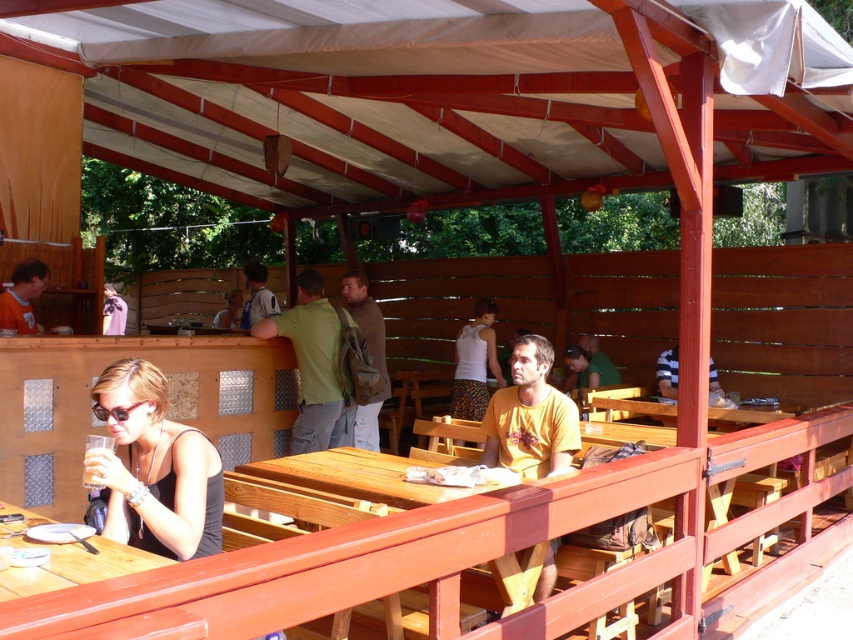
Is matte black tank top at lower left closer to the viewer compared to striped cotton shirt at center?

That is True.

Is point (122, 522) less distant than point (712, 364)?

Yes, it is in front of point (712, 364).

Identify the location of matte black tank top at lower left. The width and height of the screenshot is (853, 640). (155, 467).

Who is taller, yellow t-shirt at center or orange t-shirt at left?

yellow t-shirt at center is taller.

Which is more to the right, yellow t-shirt at center or orange t-shirt at left?

yellow t-shirt at center is more to the right.

Who is more distant from viewer, (534, 394) or (32, 289)?

The point (32, 289) is behind.

You are a GUI agent. You are given a task and a screenshot of the screen. Output one action in this format:
    pyautogui.click(x=<x>, y=<y>)
    Task: Click on the yellow t-shirt at center
    
    Given the screenshot: What is the action you would take?
    pyautogui.click(x=531, y=416)

Does green fabric backpack at center have a lesser width compared to matte green shirt at center?

Correct, green fabric backpack at center's width is less than matte green shirt at center's.

Which is above, green fabric backpack at center or matte green shirt at center?

matte green shirt at center is above.

Does point (372, 433) come behind point (219, 323)?

No, (372, 433) is in front of (219, 323).

Find the location of a particular element. This screenshot has height=640, width=853. green fabric backpack at center is located at coordinates (368, 353).